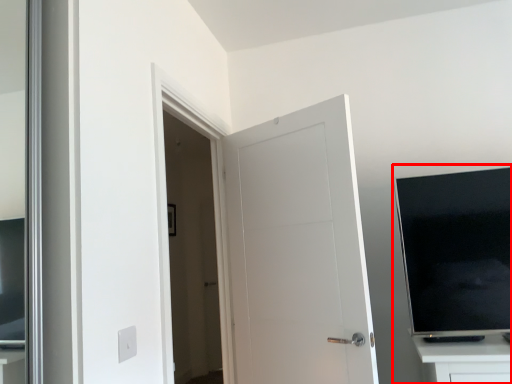
Question: From the image's perspective, what is the correct spatial relationship of entertainment center (annotated by the red box) in relation to door?

Choices:
 (A) above
 (B) below

Answer: (A)